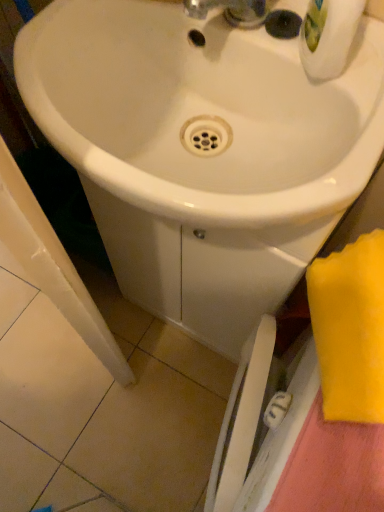
Locate an element on the screen. yellow fabric towel at lower right is located at coordinates (350, 329).

Measure the distance between yellow fabric towel at lower right and camera.

yellow fabric towel at lower right and camera are 39.87 centimeters apart from each other.

Describe the element at coordinates (350, 329) in the screenshot. I see `yellow fabric towel at lower right` at that location.

This screenshot has height=512, width=384. Describe the element at coordinates (202, 151) in the screenshot. I see `white glossy sink at center` at that location.

Where is `white glossy sink at center`? The image size is (384, 512). white glossy sink at center is located at coordinates (202, 151).

I want to click on yellow fabric towel at lower right, so click(x=350, y=329).

In the scene shown: Does white glossy sink at center appear on the left side of yellow fabric towel at lower right?

Yes, white glossy sink at center is to the left of yellow fabric towel at lower right.

Is white glossy sink at center further to camera compared to yellow fabric towel at lower right?

Yes, white glossy sink at center is behind yellow fabric towel at lower right.

In the scene shown: Which is further, (121, 14) or (363, 398)?

Positioned behind is point (121, 14).

From the image's perspective, which is above, white glossy sink at center or yellow fabric towel at lower right?

white glossy sink at center appears higher in the image.

From a real-world perspective, is white glossy sink at center on top of yellow fabric towel at lower right?

No, from a real-world perspective, white glossy sink at center is not above yellow fabric towel at lower right.

Which of these two, white glossy sink at center or yellow fabric towel at lower right, is wider?

white glossy sink at center is wider.

Consider the image. Between white glossy sink at center and yellow fabric towel at lower right, which one has more height?

With more height is white glossy sink at center.

Considering the sizes of objects white glossy sink at center and yellow fabric towel at lower right in the image provided, who is smaller, white glossy sink at center or yellow fabric towel at lower right?

Smaller between the two is yellow fabric towel at lower right.

Is yellow fabric towel at lower right located within white glossy sink at center?

Definitely not — yellow fabric towel at lower right is not inside white glossy sink at center.

Consider the image. Is white glossy sink at center placed right next to yellow fabric towel at lower right?

No.

Consider the image. Is white glossy sink at center oriented towards yellow fabric towel at lower right?

No, white glossy sink at center is not facing towards yellow fabric towel at lower right.

The image size is (384, 512). Identify the location of beach towel above the white glossy sink at center (from a real-world perspective). (350, 329).

Between yellow fabric towel at lower right and white glossy sink at center, which one appears on the left side from the viewer's perspective?

Positioned to the left is white glossy sink at center.

Looking at this image, considering the relative positions of yellow fabric towel at lower right and white glossy sink at center in the image provided, is yellow fabric towel at lower right behind white glossy sink at center?

No.

Considering the positions of point (319, 314) and point (210, 252), is point (319, 314) closer or farther from the camera than point (210, 252)?

Point (319, 314) appears to be closer to the viewer than point (210, 252).

From the image's perspective, would you say yellow fabric towel at lower right is shown under white glossy sink at center?

Yes.

From a real-world perspective, which is physically above, yellow fabric towel at lower right or white glossy sink at center?

From a 3D spatial view, yellow fabric towel at lower right is above.

Considering the sizes of yellow fabric towel at lower right and white glossy sink at center in the image, is yellow fabric towel at lower right wider or thinner than white glossy sink at center?

Clearly, yellow fabric towel at lower right has less width compared to white glossy sink at center.

Which of these two, yellow fabric towel at lower right or white glossy sink at center, stands taller?

With more height is white glossy sink at center.

Based on the photo, can you confirm if yellow fabric towel at lower right is smaller than white glossy sink at center?

Yes.

Do you think yellow fabric towel at lower right is within white glossy sink at center, or outside of it?

yellow fabric towel at lower right is not enclosed by white glossy sink at center.

Are yellow fabric towel at lower right and white glossy sink at center far apart?

Actually, yellow fabric towel at lower right and white glossy sink at center are a little close together.

Is yellow fabric towel at lower right facing towards white glossy sink at center?

No, yellow fabric towel at lower right is not aimed at white glossy sink at center.

What's the angular difference between yellow fabric towel at lower right and white glossy sink at center's facing directions?

yellow fabric towel at lower right and white glossy sink at center are facing 62.7 degrees away from each other.

How much distance is there between yellow fabric towel at lower right and white glossy sink at center?

yellow fabric towel at lower right is 8.46 inches from white glossy sink at center.

At what (x,y) coordinates should I click in order to perform the action: click on beach towel positioned vertically above the white glossy sink at center (from a real-world perspective). Please return your answer as a coordinate pair (x, y). This screenshot has height=512, width=384. Looking at the image, I should click on (350, 329).

The height and width of the screenshot is (512, 384). I want to click on beach towel that appears above the white glossy sink at center (from a real-world perspective), so 350,329.

Locate an element on the screen. sink behind the yellow fabric towel at lower right is located at coordinates (202, 151).